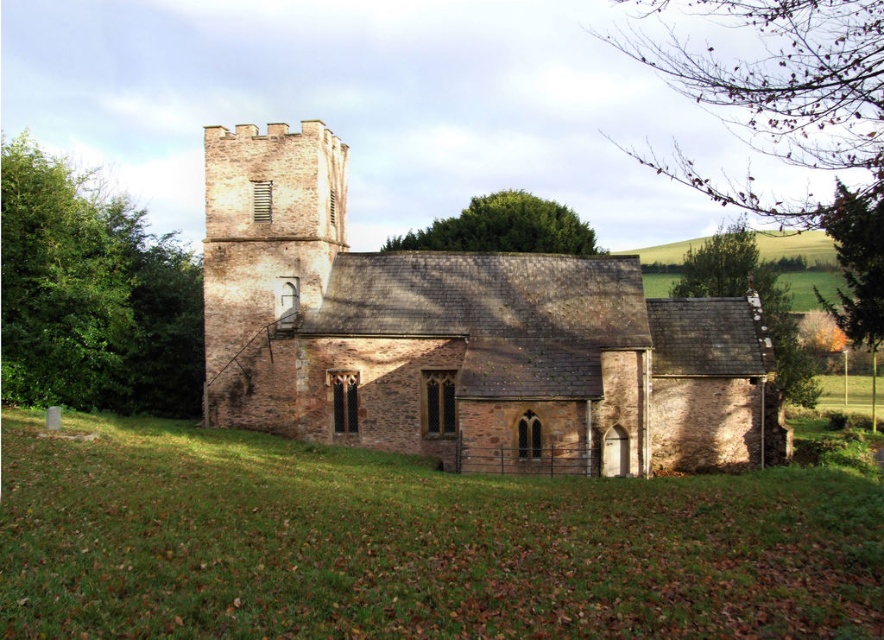
You are standing in a field looking at the brown stone church at center and the green leafy tree at upper center. Which object takes up more visual space in the image?

The green leafy tree at upper center takes up more visual space in the image than the brown stone church at center, as it occupies more area according to the description.

You are standing in a field looking at the brown stone church at center and the green leafy tree at upper center. Which object is positioned to the left of the other?

The brown stone church at center is to the left of green leafy tree at upper center according to the description.